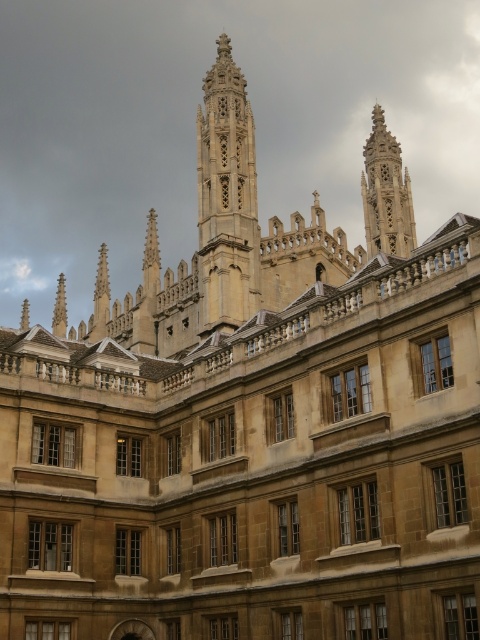
Question: Is golden stone tower at center positioned at the back of golden stone spire at upper center?

Choices:
 (A) no
 (B) yes

Answer: (A)

Question: Does golden stone tower at center have a greater width compared to golden stone spire at upper center?

Choices:
 (A) no
 (B) yes

Answer: (B)

Question: Which point is closer to the camera taking this photo?

Choices:
 (A) (252, 300)
 (B) (389, 228)

Answer: (A)

Question: Does golden stone tower at center appear under golden stone spire at upper center?

Choices:
 (A) no
 (B) yes

Answer: (A)